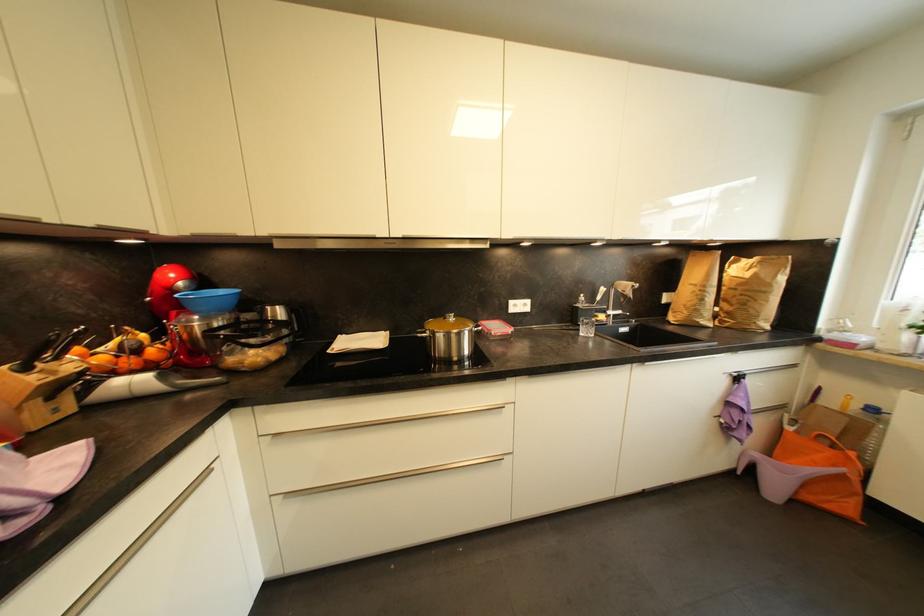
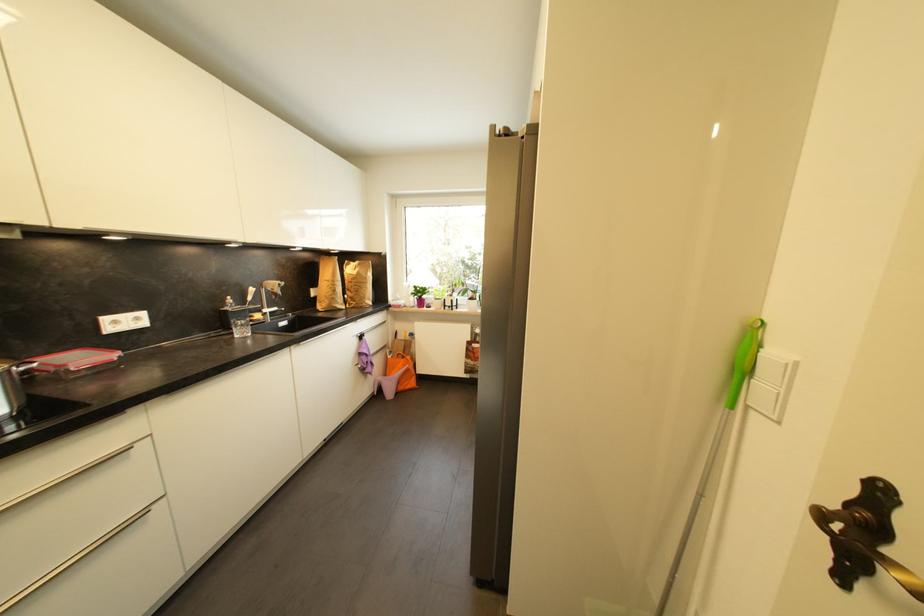
The point at (707, 302) is marked in the first image. Where is the corresponding point in the second image?

(339, 293)